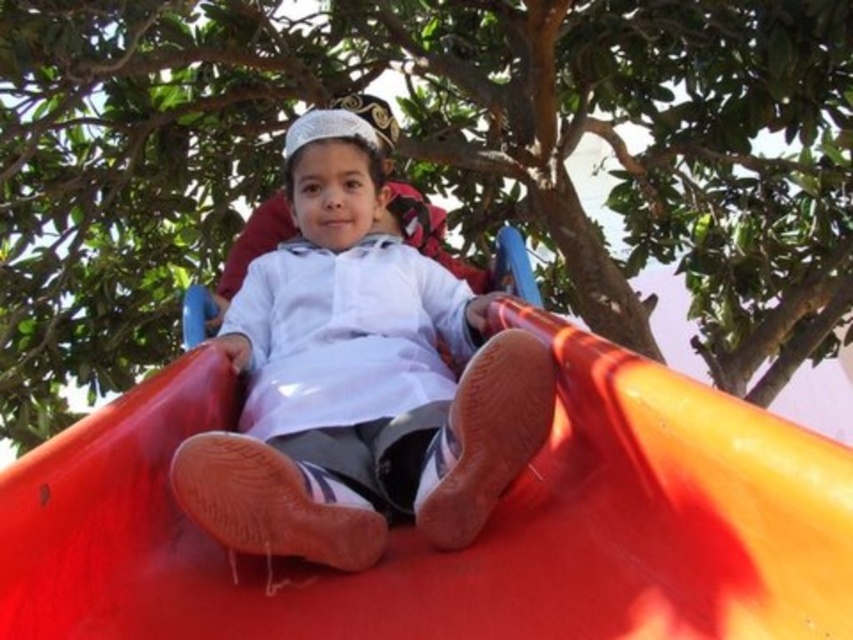
Does green leafy tree at upper center have a lesser height compared to white matte shirt at center?

No.

The height and width of the screenshot is (640, 853). Describe the element at coordinates (426, 163) in the screenshot. I see `green leafy tree at upper center` at that location.

Identify the location of green leafy tree at upper center. The image size is (853, 640). (426, 163).

Is point (155, 496) closer to camera compared to point (490, 454)?

Yes, it is in front of point (490, 454).

Which is below, rubberized red slide at center or white matte shirt at center?

Positioned lower is rubberized red slide at center.

Who is more forward, (48, 470) or (364, 426)?

Point (48, 470)

At what (x,y) coordinates should I click in order to perform the action: click on rubberized red slide at center. Please return your answer as a coordinate pair (x, y). The width and height of the screenshot is (853, 640). Looking at the image, I should click on (479, 538).

Does green leafy tree at upper center have a greater height compared to rubberized red slide at center?

Indeed, green leafy tree at upper center has a greater height compared to rubberized red slide at center.

This screenshot has height=640, width=853. Describe the element at coordinates (426, 163) in the screenshot. I see `green leafy tree at upper center` at that location.

Where is `green leafy tree at upper center`? This screenshot has height=640, width=853. green leafy tree at upper center is located at coordinates (426, 163).